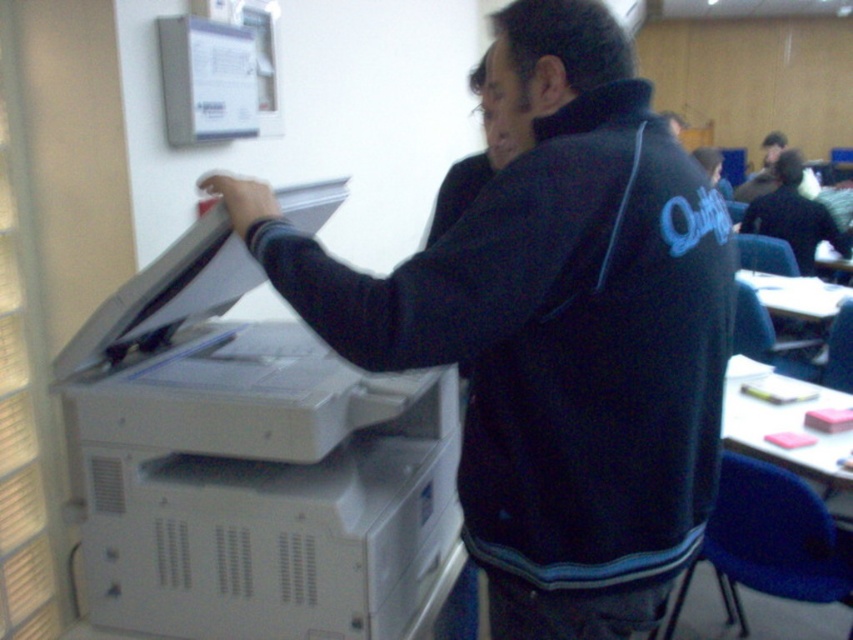
You are a delivery person who needs to place a package on the white paper at upper center without touching the black matte jacket at center. The package is 1 meter long. Can you fit it between them?

The distance between the black matte jacket at center and the white paper at upper center is 94.01 centimeters. Since the package is 1 meter long, which is longer than the available space, it won not fit between them.

You are a maintenance technician with a tool box that is 1.1 meters wide. You need to walk from the camera position to the white plastic printer at left to perform a repair. Is there enough space for your tool box to fit through the path between the camera and the printer?

The distance between the white plastic printer at left and the camera is 1.20 meters. Since your tool box is 1.1 meters wide, there is enough space for it to fit through the path between the camera and the white plastic printer at left.